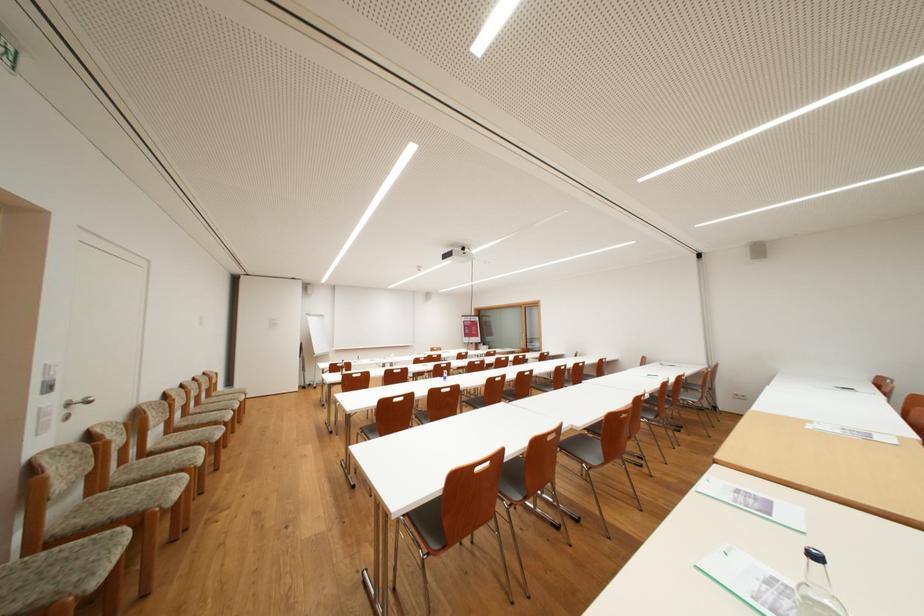
Locate an element on the screen. This screenshot has height=616, width=924. silver door handle is located at coordinates (79, 400).